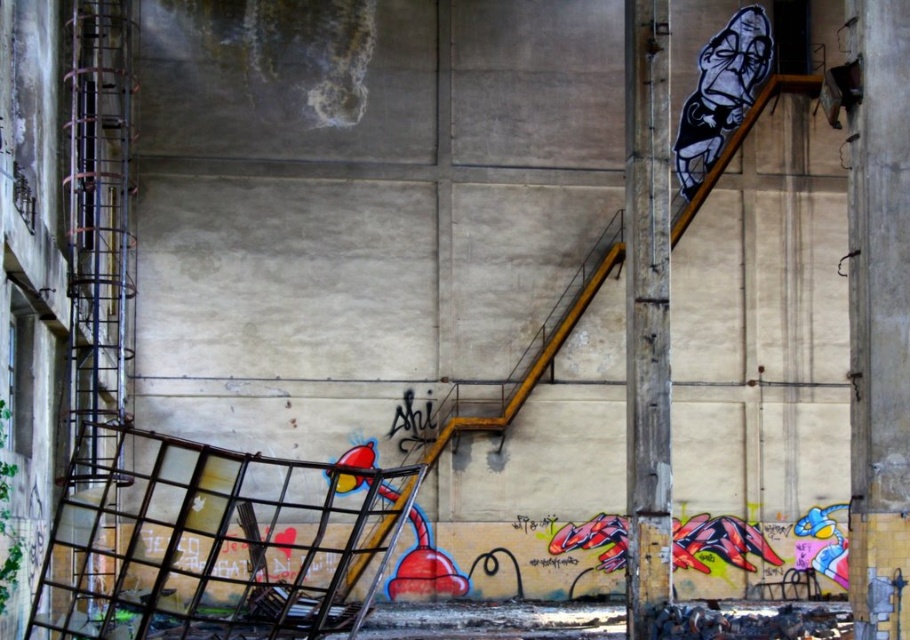
From the picture: You are standing in the abandoned industrial building and need to locate the rusty metal pole at right. According to the coordinates provided, where should you look relative to the entrance?

The rusty metal pole at right is located at point 0.484 on the x and 0.712 on the y axis. Since coordinates typically start from the bottom left corner, this places it towards the upper right section of the image, so you should look towards the upper right area relative to the entrance.

Looking at this image, you are a maintenance worker inspecting an abandoned industrial building. You notice the rusty metal pole at right and the black and white graffiti at upper right. Which object is positioned higher in the image?

The black and white graffiti at upper right is positioned higher than the rusty metal pole at right.

You are standing at the entrance of the abandoned industrial building and want to reach the staircase on the right. There are two points marked in the scene. Which point, point (641, 536) or point (721, 120), is closer to you as you face the building?

Point (641, 536) is closer to the viewer than point (721, 120), so you should head towards point (641, 536) first.